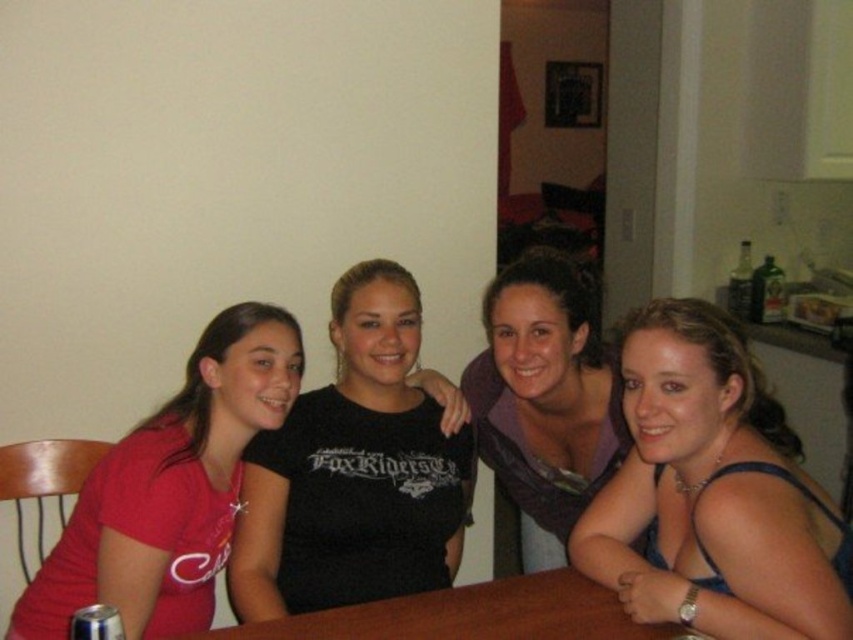
Question: Which of the following is the closest to the observer?

Choices:
 (A) (717, 456)
 (B) (436, 625)
 (C) (20, 637)

Answer: (A)

Question: Estimate the real-world distances between objects in this image. Which object is farther from the black matte shirt at center?

Choices:
 (A) purple soft scarf at center
 (B) brown wooden table at center

Answer: (B)

Question: Is blue fabric dress at center closer to the viewer compared to black matte shirt at center?

Choices:
 (A) no
 (B) yes

Answer: (B)

Question: Considering the real-world distances, which object is farthest from the purple soft scarf at center?

Choices:
 (A) brown wooden table at center
 (B) blue fabric dress at center

Answer: (A)

Question: Can you confirm if matte red shirt at left is bigger than brown wooden table at center?

Choices:
 (A) no
 (B) yes

Answer: (B)

Question: Can you confirm if purple soft scarf at center is positioned to the left of brown wooden table at center?

Choices:
 (A) no
 (B) yes

Answer: (A)